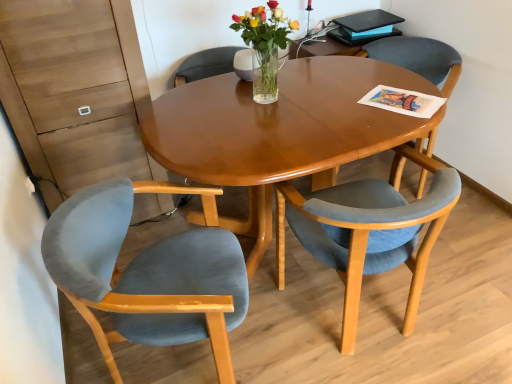
Question: Is velvet blue chair at lower right, arranged as the second chair when viewed from the left, aimed at matte black magazine at upper right?

Choices:
 (A) no
 (B) yes

Answer: (B)

Question: From a real-world perspective, is velvet blue chair at lower right, arranged as the second chair when viewed from the left, physically above matte black magazine at upper right?

Choices:
 (A) yes
 (B) no

Answer: (B)

Question: Is velvet blue chair at lower right, which appears as the second chair when viewed from the right, at the right side of matte black magazine at upper right?

Choices:
 (A) yes
 (B) no

Answer: (B)

Question: Is velvet blue chair at lower right, which appears as the second chair when viewed from the right, in front of matte black magazine at upper right?

Choices:
 (A) no
 (B) yes

Answer: (B)

Question: Can you confirm if velvet blue chair at lower right, arranged as the second chair when viewed from the left, is taller than matte black magazine at upper right?

Choices:
 (A) yes
 (B) no

Answer: (A)

Question: Considering the positions of velvet blue chair at lower left, placed as the 1th chair when sorted from left to right, and matte black magazine at upper right in the image, is velvet blue chair at lower left, placed as the 1th chair when sorted from left to right, taller or shorter than matte black magazine at upper right?

Choices:
 (A) tall
 (B) short

Answer: (A)

Question: Considering the positions of velvet blue chair at lower left, the third chair viewed from the right, and matte black magazine at upper right in the image, is velvet blue chair at lower left, the third chair viewed from the right, bigger or smaller than matte black magazine at upper right?

Choices:
 (A) small
 (B) big

Answer: (B)

Question: From the image's perspective, relative to matte black magazine at upper right, is velvet blue chair at lower left, placed as the 1th chair when sorted from left to right, above or below?

Choices:
 (A) above
 (B) below

Answer: (B)

Question: Do you think velvet blue chair at lower left, the third chair viewed from the right, is within matte black magazine at upper right, or outside of it?

Choices:
 (A) inside
 (B) outside

Answer: (B)

Question: From a real-world perspective, is matte black magazine at upper right physically located above or below clear glass vase at center?

Choices:
 (A) above
 (B) below

Answer: (B)

Question: Is point (384, 31) closer or farther from the camera than point (268, 52)?

Choices:
 (A) farther
 (B) closer

Answer: (A)

Question: In terms of size, does matte black magazine at upper right appear bigger or smaller than clear glass vase at center?

Choices:
 (A) big
 (B) small

Answer: (B)

Question: Considering their positions, is matte black magazine at upper right located in front of or behind clear glass vase at center?

Choices:
 (A) behind
 (B) front

Answer: (A)

Question: From the image's perspective, is velvet blue chair at center, the 3th chair in the left-to-right sequence, positioned above or below velvet blue chair at lower right, arranged as the second chair when viewed from the left?

Choices:
 (A) below
 (B) above

Answer: (B)

Question: From a real-world perspective, is velvet blue chair at center, the 3th chair in the left-to-right sequence, physically located above or below velvet blue chair at lower right, arranged as the second chair when viewed from the left?

Choices:
 (A) above
 (B) below

Answer: (A)